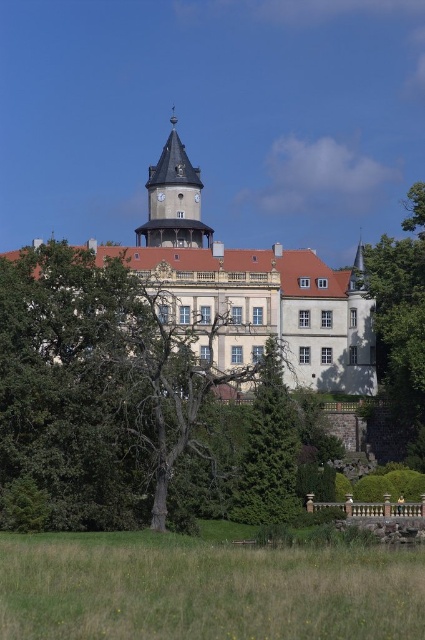
Question: Where is green leafy tree at center located in relation to white stone palace at center in the image?

Choices:
 (A) above
 (B) below

Answer: (B)

Question: Which is nearer to the green leafy tree at center?

Choices:
 (A) green grass at lower center
 (B) matte gray clock tower at center

Answer: (A)

Question: Can you confirm if white stone palace at center is bigger than green textured tree at center?

Choices:
 (A) yes
 (B) no

Answer: (A)

Question: Which point is closer to the camera?

Choices:
 (A) white stone palace at center
 (B) matte gray clock tower at center

Answer: (A)

Question: Does green leafy tree at center appear on the right side of green grass at lower center?

Choices:
 (A) no
 (B) yes

Answer: (A)

Question: Which of the following is the farthest from the observer?

Choices:
 (A) pyautogui.click(x=144, y=230)
 (B) pyautogui.click(x=176, y=368)
 (C) pyautogui.click(x=365, y=634)
 (D) pyautogui.click(x=408, y=257)

Answer: (A)